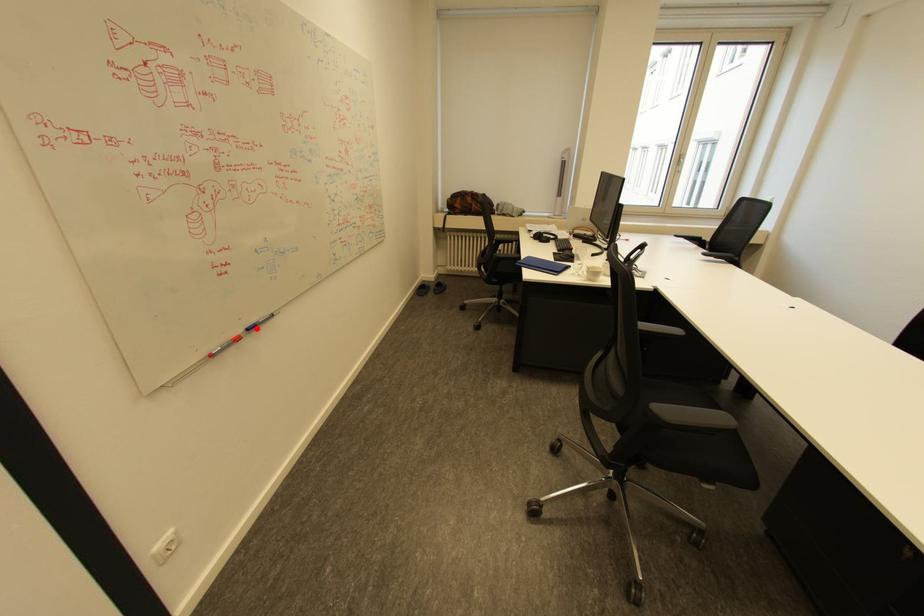
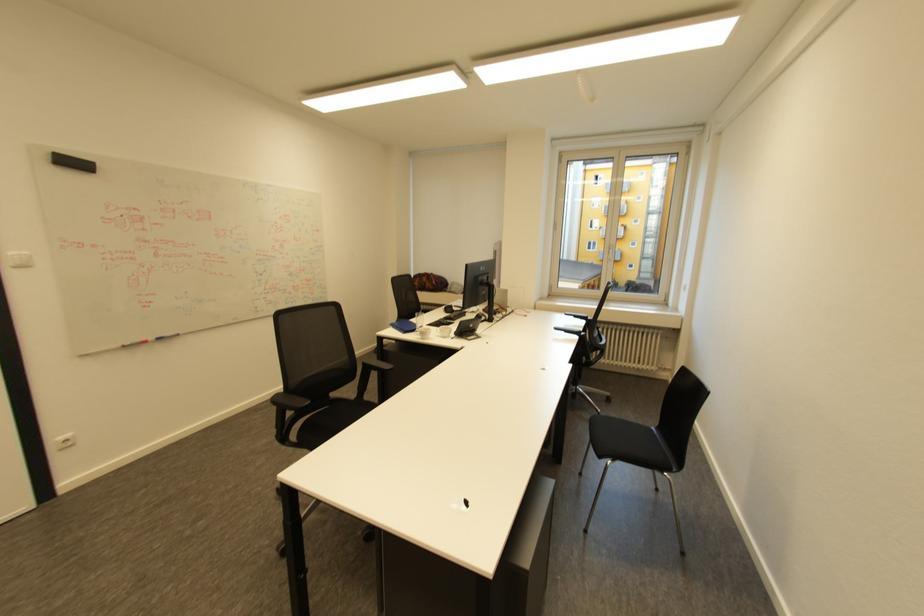
Where in the second image is the point corresponding to the highlighted location from the first image?

(164, 339)